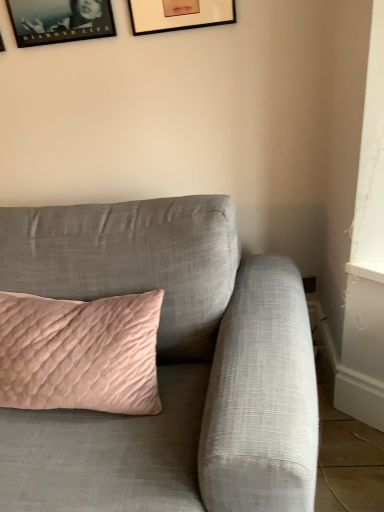
Question: Considering the relative sizes of matte black picture frame at upper center, which appears as the first picture frame when viewed from the right, and matte black picture frame at upper left, which is counted as the first picture frame, starting from the left, in the image provided, is matte black picture frame at upper center, which appears as the first picture frame when viewed from the right, wider than matte black picture frame at upper left, which is counted as the first picture frame, starting from the left,?

Choices:
 (A) no
 (B) yes

Answer: (A)

Question: Is matte black picture frame at upper center, which appears as the first picture frame when viewed from the right, behind matte black picture frame at upper left, which is counted as the first picture frame, starting from the left?

Choices:
 (A) yes
 (B) no

Answer: (B)

Question: Can you confirm if matte black picture frame at upper center, which appears as the first picture frame when viewed from the right, is positioned to the right of matte black picture frame at upper left, positioned as the 3th picture frame in right-to-left order?

Choices:
 (A) yes
 (B) no

Answer: (A)

Question: From a real-world perspective, is matte black picture frame at upper center, marked as the 3th picture frame in a left-to-right arrangement, below matte black picture frame at upper left, which is counted as the first picture frame, starting from the left?

Choices:
 (A) no
 (B) yes

Answer: (A)

Question: From a real-world perspective, is matte black picture frame at upper center, marked as the 3th picture frame in a left-to-right arrangement, physically above matte black picture frame at upper left, positioned as the 3th picture frame in right-to-left order?

Choices:
 (A) yes
 (B) no

Answer: (A)

Question: Considering the positions of matte black picture frame at upper center, which appears as the first picture frame when viewed from the right, and matte gray couch at center in the image, is matte black picture frame at upper center, which appears as the first picture frame when viewed from the right, wider or thinner than matte gray couch at center?

Choices:
 (A) wide
 (B) thin

Answer: (B)

Question: From a real-world perspective, is matte black picture frame at upper center, which appears as the first picture frame when viewed from the right, positioned above or below matte gray couch at center?

Choices:
 (A) above
 (B) below

Answer: (A)

Question: From the image's perspective, relative to matte gray couch at center, is matte black picture frame at upper center, marked as the 3th picture frame in a left-to-right arrangement, above or below?

Choices:
 (A) below
 (B) above

Answer: (B)

Question: In terms of size, does matte black picture frame at upper center, marked as the 3th picture frame in a left-to-right arrangement, appear bigger or smaller than matte gray couch at center?

Choices:
 (A) big
 (B) small

Answer: (B)

Question: From the image's perspective, is matte black picture frame at upper left, which is counted as the first picture frame, starting from the left, located above or below matte black picture frame at upper center, marked as the 3th picture frame in a left-to-right arrangement?

Choices:
 (A) above
 (B) below

Answer: (B)

Question: Considering the positions of matte black picture frame at upper left, which is counted as the first picture frame, starting from the left, and matte black picture frame at upper center, which appears as the first picture frame when viewed from the right, in the image, is matte black picture frame at upper left, which is counted as the first picture frame, starting from the left, bigger or smaller than matte black picture frame at upper center, which appears as the first picture frame when viewed from the right,?

Choices:
 (A) small
 (B) big

Answer: (B)

Question: Would you say matte black picture frame at upper left, positioned as the 3th picture frame in right-to-left order, is to the left or to the right of matte black picture frame at upper center, marked as the 3th picture frame in a left-to-right arrangement, in the picture?

Choices:
 (A) right
 (B) left

Answer: (B)

Question: Considering the positions of matte black picture frame at upper left, positioned as the 3th picture frame in right-to-left order, and matte black picture frame at upper center, marked as the 3th picture frame in a left-to-right arrangement, in the image, is matte black picture frame at upper left, positioned as the 3th picture frame in right-to-left order, wider or thinner than matte black picture frame at upper center, marked as the 3th picture frame in a left-to-right arrangement,?

Choices:
 (A) wide
 (B) thin

Answer: (A)

Question: Looking at their shapes, would you say matte gray couch at center is wider or thinner than matte black picture frame at upper left, placed as the 2th picture frame when sorted from right to left?

Choices:
 (A) wide
 (B) thin

Answer: (A)

Question: From a real-world perspective, is matte gray couch at center positioned above or below matte black picture frame at upper left, placed as the 2th picture frame when sorted from right to left?

Choices:
 (A) below
 (B) above

Answer: (A)